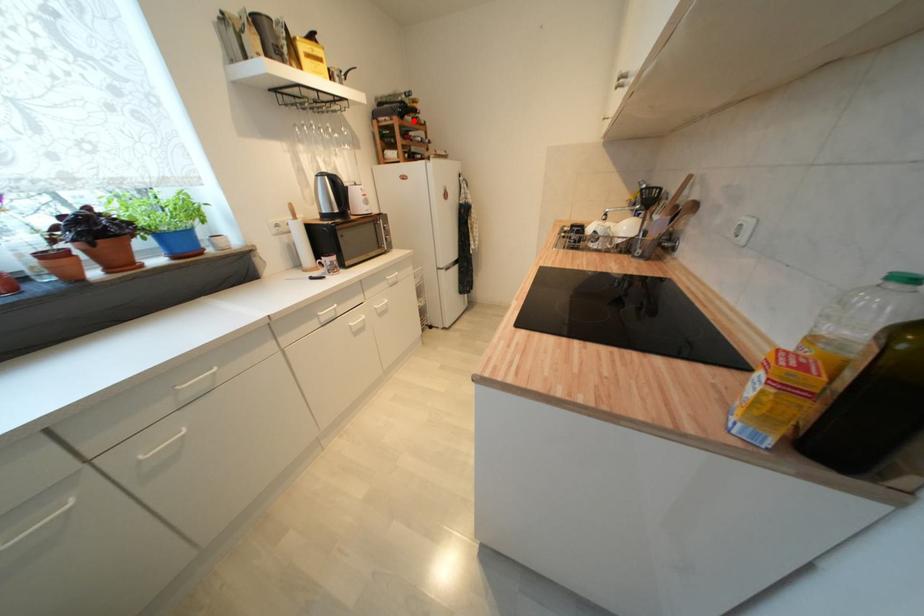
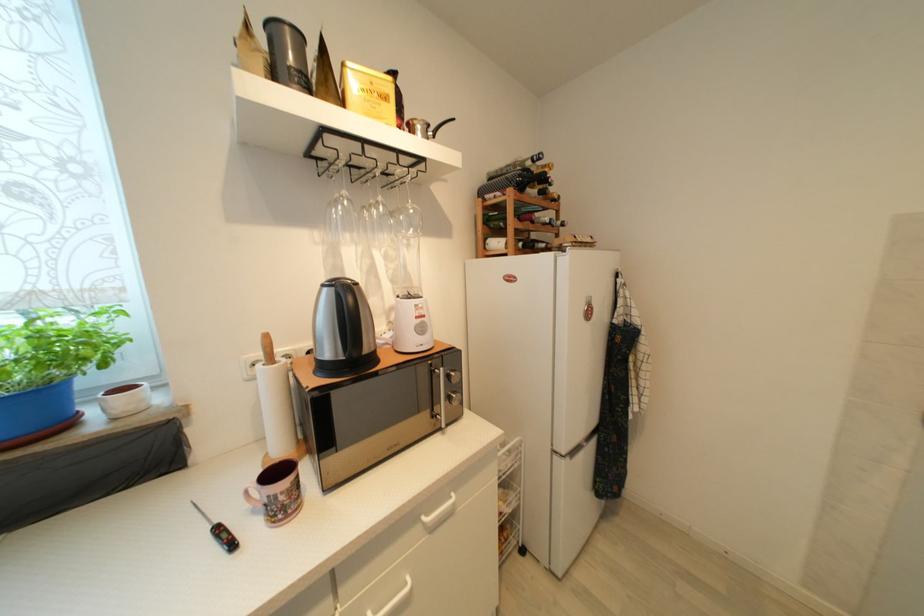
Locate, in the second image, the point that corresponds to the highlighted location in the first image.

(538, 193)